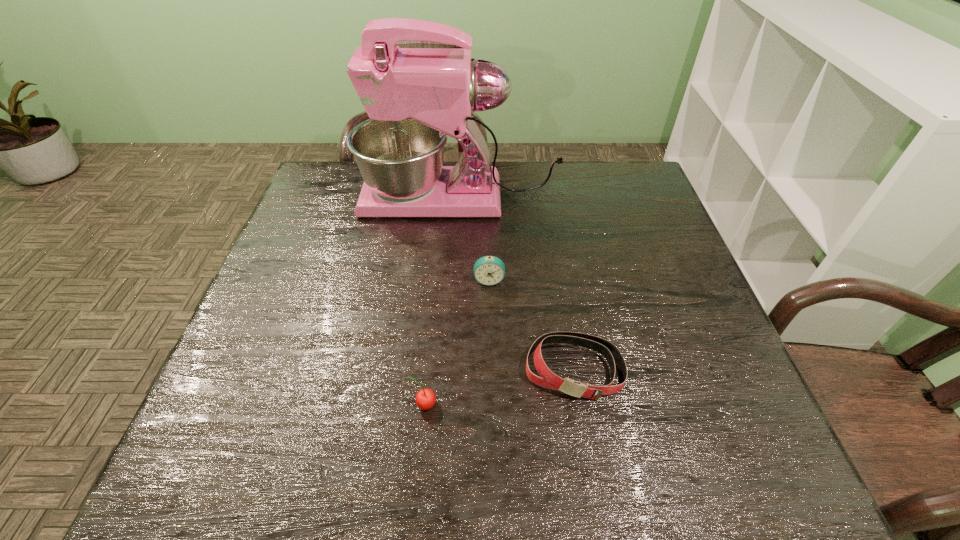
Identify which object is the closest to the cherry. Please provide its 2D coordinates. Your answer should be formatted as a tuple, i.e. [(x, y)], where the tuple contains the x and y coordinates of a point satisfying the conditions above.

[(548, 379)]

You are a GUI agent. You are given a task and a screenshot of the screen. Output one action in this format:
    pyautogui.click(x=<x>, y=<y>)
    Task: Click on the free location that satisfies the following two spatial constraints: 1. on the front-facing side of the dog collar; 2. on the left side of the alarm clock
    
    Given the screenshot: What is the action you would take?
    pyautogui.click(x=491, y=369)

Find the location of a particular element. The height and width of the screenshot is (540, 960). vacant position in the image that satisfies the following two spatial constraints: 1. on the front-facing side of the alarm clock; 2. on the left side of the shortest object is located at coordinates (491, 369).

Where is `free spot that satisfies the following two spatial constraints: 1. on the back side of the dog collar; 2. on the face of the farthest object`? This screenshot has height=540, width=960. free spot that satisfies the following two spatial constraints: 1. on the back side of the dog collar; 2. on the face of the farthest object is located at coordinates coord(544,198).

The width and height of the screenshot is (960, 540). I want to click on vacant region that satisfies the following two spatial constraints: 1. on the face of the mixer; 2. on the front side of the cherry, so click(450, 404).

Find the location of a particular element. This screenshot has width=960, height=540. free space that satisfies the following two spatial constraints: 1. on the front-facing side of the dog collar; 2. on the right side of the second farthest object is located at coordinates (491, 369).

In order to click on vacant region that satisfies the following two spatial constraints: 1. on the face of the dog collar; 2. on the left side of the mixer in this screenshot , I will do `click(451, 369)`.